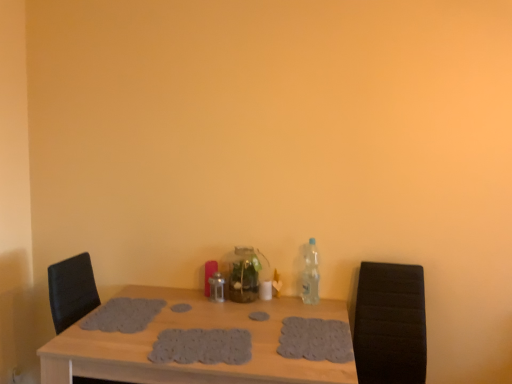
Identify the location of free spot above gray textured placemat at center, marked as the fourth footprint in a left-to-right arrangement (from a real-world perspective). (316, 334).